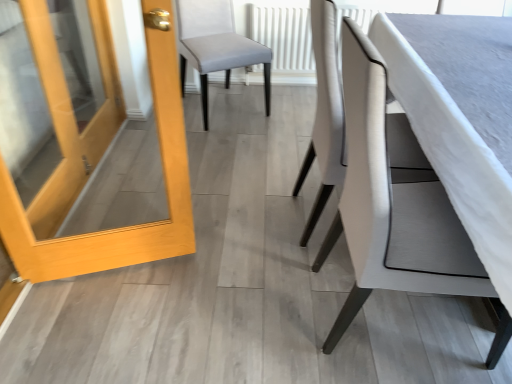
Question: In which direction should I rotate to look at light gray fabric chair at center, the 3th chair from the front?

Choices:
 (A) left
 (B) right

Answer: (A)

Question: Does white fabric chair at center, the second chair from the front, have a greater height compared to white textured radiator at center?

Choices:
 (A) yes
 (B) no

Answer: (A)

Question: Is white textured radiator at center completely or partially inside white fabric chair at center, which is counted as the 2th chair, starting from the back?

Choices:
 (A) no
 (B) yes

Answer: (A)

Question: Does white fabric chair at center, which is counted as the 2th chair, starting from the back, turn towards white textured radiator at center?

Choices:
 (A) no
 (B) yes

Answer: (A)

Question: Can you confirm if white fabric chair at center, which is counted as the 2th chair, starting from the back, is positioned to the right of white textured radiator at center?

Choices:
 (A) yes
 (B) no

Answer: (B)

Question: Considering the relative sizes of white fabric chair at center, which is counted as the 2th chair, starting from the back, and white textured radiator at center in the image provided, is white fabric chair at center, which is counted as the 2th chair, starting from the back, shorter than white textured radiator at center?

Choices:
 (A) yes
 (B) no

Answer: (B)

Question: From the image's perspective, is white fabric chair at center, the second chair from the front, located above white textured radiator at center?

Choices:
 (A) yes
 (B) no

Answer: (B)

Question: From a real-world perspective, is white fabric chair at center, which is counted as the 2th chair, starting from the back, positioned under light gray fabric chair at center, which ranks as the first chair in back-to-front order, based on gravity?

Choices:
 (A) yes
 (B) no

Answer: (B)

Question: Does white fabric chair at center, which is counted as the 2th chair, starting from the back, have a larger size compared to light gray fabric chair at center, which ranks as the first chair in back-to-front order?

Choices:
 (A) yes
 (B) no

Answer: (B)

Question: Can you confirm if white fabric chair at center, which is counted as the 2th chair, starting from the back, is thinner than light gray fabric chair at center, the 3th chair from the front?

Choices:
 (A) yes
 (B) no

Answer: (A)

Question: Is white fabric chair at center, the second chair from the front, facing towards light gray fabric chair at center, the 3th chair from the front?

Choices:
 (A) yes
 (B) no

Answer: (B)

Question: Does white fabric chair at center, the second chair from the front, appear on the left side of light gray fabric chair at center, the 3th chair from the front?

Choices:
 (A) yes
 (B) no

Answer: (B)

Question: From the image's perspective, does white fabric chair at center, the second chair from the front, appear lower than light gray fabric chair at center, the 3th chair from the front?

Choices:
 (A) no
 (B) yes

Answer: (B)

Question: Considering the relative sizes of white fabric chair at center, which is the first chair in front-to-back order, and white fabric chair at center, which is counted as the 2th chair, starting from the back, in the image provided, is white fabric chair at center, which is the first chair in front-to-back order, taller than white fabric chair at center, which is counted as the 2th chair, starting from the back,?

Choices:
 (A) yes
 (B) no

Answer: (A)